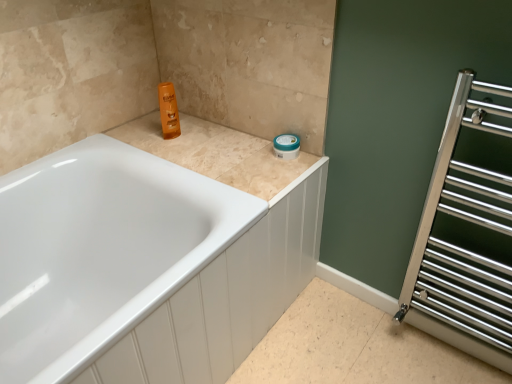
What are the coordinates of `polished chrome towel rack at right` in the screenshot? It's located at (467, 229).

Describe the element at coordinates (100, 250) in the screenshot. This screenshot has height=384, width=512. I see `white glossy bathtub at upper left` at that location.

This screenshot has height=384, width=512. I want to click on polished chrome towel rack at right, so click(x=467, y=229).

Is white glossy bathtub at upper left in front of beige tile counter top at upper center?

Yes, white glossy bathtub at upper left is in front of beige tile counter top at upper center.

Are white glossy bathtub at upper left and beige tile counter top at upper center located far from each other?

No, white glossy bathtub at upper left is not far from beige tile counter top at upper center.

Consider the image. From the image's perspective, which is below, white glossy bathtub at upper left or beige tile counter top at upper center?

white glossy bathtub at upper left, from the image's perspective.

Looking at this image, considering the relative sizes of white glossy bathtub at upper left and beige tile counter top at upper center in the image provided, is white glossy bathtub at upper left shorter than beige tile counter top at upper center?

In fact, white glossy bathtub at upper left may be taller than beige tile counter top at upper center.

Can you tell me how much polished chrome towel rack at right and beige tile counter top at upper center differ in facing direction?

polished chrome towel rack at right and beige tile counter top at upper center are facing 0.684 degrees away from each other.

Locate an element on the screen. counter top behind the polished chrome towel rack at right is located at coordinates (217, 153).

Who is taller, polished chrome towel rack at right or beige tile counter top at upper center?

polished chrome towel rack at right is taller.

Is polished chrome towel rack at right situated inside beige tile counter top at upper center or outside?

polished chrome towel rack at right is spatially situated outside beige tile counter top at upper center.

How many degrees apart are the facing directions of white glossy bathtub at upper left and polished chrome towel rack at right?

There is a 90.3-degree angle between the facing directions of white glossy bathtub at upper left and polished chrome towel rack at right.

From the image's perspective, would you say white glossy bathtub at upper left is positioned over polished chrome towel rack at right?

Actually, white glossy bathtub at upper left appears below polished chrome towel rack at right in the image.

Between white glossy bathtub at upper left and polished chrome towel rack at right, which one has smaller size?

Smaller between the two is polished chrome towel rack at right.

Is white glossy bathtub at upper left surrounding polished chrome towel rack at right?

Actually, polished chrome towel rack at right is outside white glossy bathtub at upper left.

Is beige tile counter top at upper center turned away from white glossy bathtub at upper left?

That's not correct — beige tile counter top at upper center is not looking away from white glossy bathtub at upper left.

Is beige tile counter top at upper center closer to the viewer compared to white glossy bathtub at upper left?

No, beige tile counter top at upper center is behind white glossy bathtub at upper left.

In terms of size, does beige tile counter top at upper center appear bigger or smaller than white glossy bathtub at upper left?

Clearly, beige tile counter top at upper center is smaller in size than white glossy bathtub at upper left.

In the scene shown: Would you say white glossy bathtub at upper left is part of beige tile counter top at upper center's contents?

No, white glossy bathtub at upper left is not inside beige tile counter top at upper center.

Measure the distance between beige tile counter top at upper center and polished chrome towel rack at right.

beige tile counter top at upper center is 25.29 inches from polished chrome towel rack at right.

Is point (166, 158) closer or farther from the camera than point (489, 247)?

Point (166, 158) appears to be farther away from the viewer than point (489, 247).

Are beige tile counter top at upper center and polished chrome towel rack at right making contact?

No, beige tile counter top at upper center is not next to polished chrome towel rack at right.

Does beige tile counter top at upper center turn towards polished chrome towel rack at right?

No, beige tile counter top at upper center is not oriented towards polished chrome towel rack at right.

Can we say polished chrome towel rack at right lies outside white glossy bathtub at upper left?

polished chrome towel rack at right is positioned outside white glossy bathtub at upper left.

Is polished chrome towel rack at right aimed at white glossy bathtub at upper left?

No, polished chrome towel rack at right is not facing towards white glossy bathtub at upper left.

From a real-world perspective, which object stands above the other?

From a 3D spatial view, polished chrome towel rack at right is above.

Who is bigger, polished chrome towel rack at right or white glossy bathtub at upper left?

white glossy bathtub at upper left.

This screenshot has width=512, height=384. Identify the location of bathtub located underneath the beige tile counter top at upper center (from a real-world perspective). (x=100, y=250).

Find the location of a particular element. This screenshot has height=384, width=512. counter top located above the polished chrome towel rack at right (from the image's perspective) is located at coordinates (217, 153).

When comparing their distances from beige tile counter top at upper center, does white glossy bathtub at upper left or polished chrome towel rack at right seem closer?

Based on the image, white glossy bathtub at upper left appears to be nearer to beige tile counter top at upper center.

Considering their positions, is white glossy bathtub at upper left positioned closer to polished chrome towel rack at right than beige tile counter top at upper center?

Among the two, beige tile counter top at upper center is located nearer to polished chrome towel rack at right.

When comparing their distances from white glossy bathtub at upper left, does beige tile counter top at upper center or polished chrome towel rack at right seem closer?

beige tile counter top at upper center is positioned closer to the anchor white glossy bathtub at upper left.

Which object lies nearer to the anchor point beige tile counter top at upper center, polished chrome towel rack at right or white glossy bathtub at upper left?

white glossy bathtub at upper left.

Which object lies further to the anchor point white glossy bathtub at upper left, polished chrome towel rack at right or beige tile counter top at upper center?

Among the two, polished chrome towel rack at right is located further to white glossy bathtub at upper left.

Estimate the real-world distances between objects in this image. Which object is further from polished chrome towel rack at right, beige tile counter top at upper center or white glossy bathtub at upper left?

white glossy bathtub at upper left is positioned further to the anchor polished chrome towel rack at right.

At what (x,y) coordinates should I click in order to perform the action: click on counter top between white glossy bathtub at upper left and polished chrome towel rack at right. Please return your answer as a coordinate pair (x, y). This screenshot has height=384, width=512. Looking at the image, I should click on (217, 153).